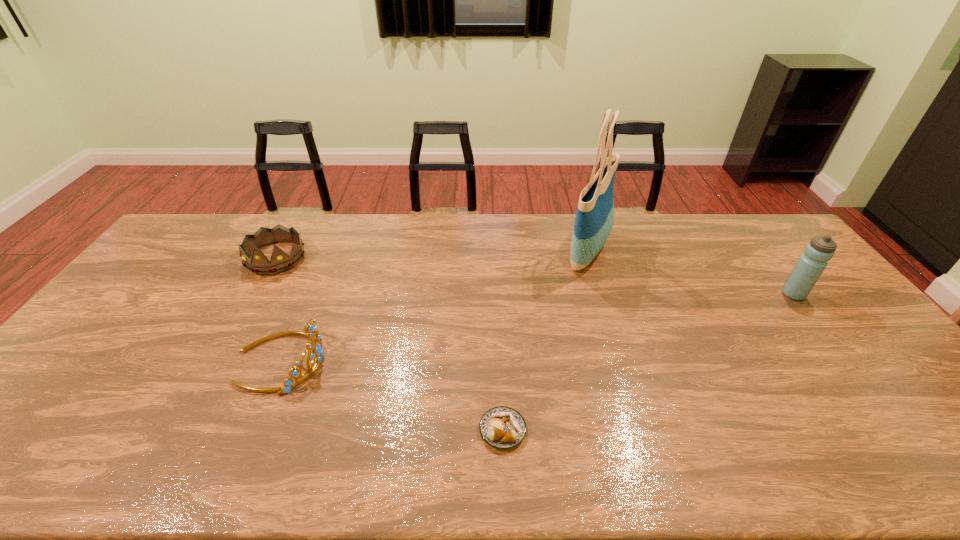
Locate an element on the screen. The image size is (960, 540). blank region between the farther tiara and the nearest object is located at coordinates (389, 344).

Identify which object is located as the second nearest to the tallest object. Please provide its 2D coordinates. Your answer should be formatted as a tuple, i.e. [(x, y)], where the tuple contains the x and y coordinates of a point satisfying the conditions above.

[(501, 427)]

At what (x,y) coordinates should I click in order to perform the action: click on object that ranks as the fourth closest to the farther tiara. Please return your answer as a coordinate pair (x, y). Looking at the image, I should click on (811, 264).

The width and height of the screenshot is (960, 540). In order to click on free location that satisfies the following two spatial constraints: 1. on the front side of the tote bag; 2. on the front-facing side of the nearer tiara in this screenshot , I will do `click(620, 360)`.

Find the location of a particular element. vacant position in the image that satisfies the following two spatial constraints: 1. on the front side of the third nearest object; 2. on the front-facing side of the second nearest object is located at coordinates (845, 360).

At what (x,y) coordinates should I click in order to perform the action: click on vacant space that satisfies the following two spatial constraints: 1. on the back side of the third object from left to right; 2. on the front-facing side of the fourth farthest object. Please return your answer as a coordinate pair (x, y). Looking at the image, I should click on (499, 360).